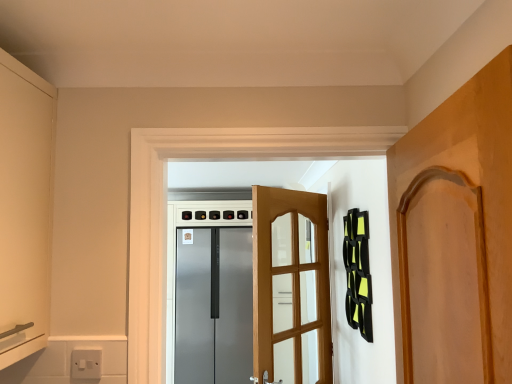
Question: Looking at their shapes, would you say wooden door at center, the second door positioned from the front, is wider or thinner than white plastic switch at lower left?

Choices:
 (A) wide
 (B) thin

Answer: (A)

Question: Considering the positions of wooden door at center, positioned as the first door in back-to-front order, and white plastic switch at lower left in the image, is wooden door at center, positioned as the first door in back-to-front order, bigger or smaller than white plastic switch at lower left?

Choices:
 (A) small
 (B) big

Answer: (B)

Question: Estimate the real-world distances between objects in this image. Which object is closer to the wooden door at right, the 2th door positioned from the back?

Choices:
 (A) wooden door at center, positioned as the first door in back-to-front order
 (B) satin silver refrigerator at center
 (C) white plastic switch at lower left

Answer: (C)

Question: Based on their relative distances, which object is nearer to the wooden door at right, the 2th door positioned from the back?

Choices:
 (A) white plastic switch at lower left
 (B) satin silver refrigerator at center
 (C) wooden door at center, positioned as the first door in back-to-front order

Answer: (A)